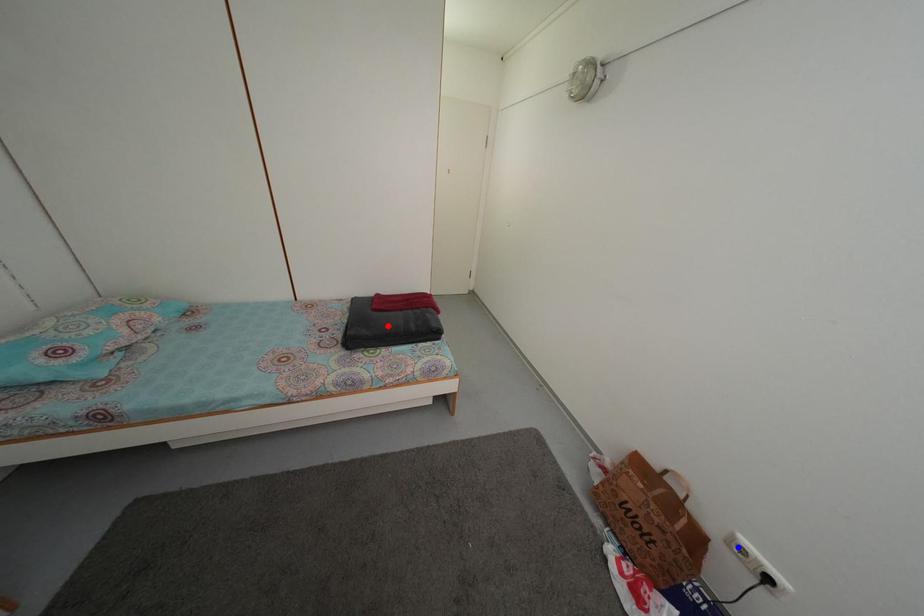
Question: Which of the two points in the image is closer to the camera?

Choices:
 (A) Blue point is closer.
 (B) Red point is closer.

Answer: (A)